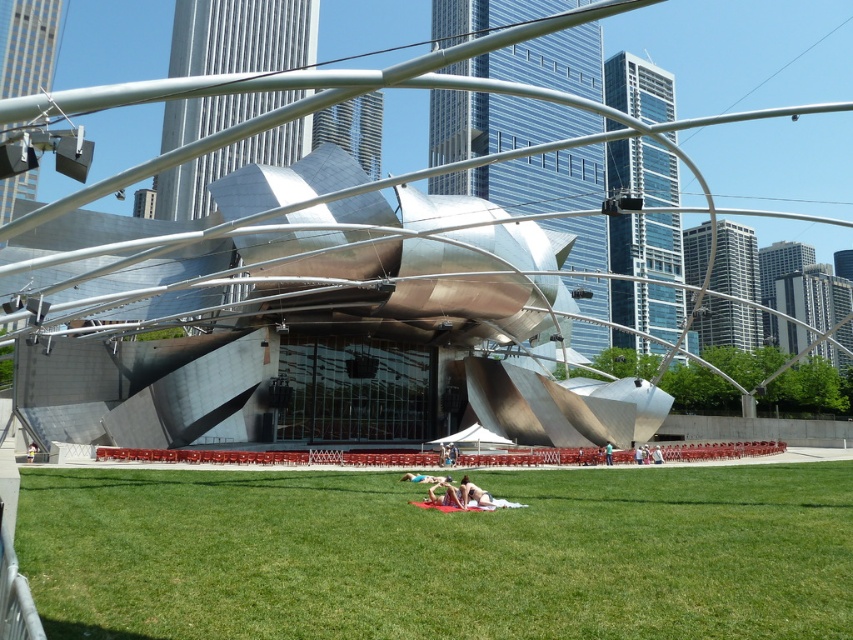
Is skinny jeans at center thinner than smooth skin person at center?

Correct, skinny jeans at center's width is less than smooth skin person at center's.

In the scene shown: Is skinny jeans at center positioned behind smooth skin person at center?

No, skinny jeans at center is closer to the viewer.

The height and width of the screenshot is (640, 853). What do you see at coordinates (444, 493) in the screenshot?
I see `skinny jeans at center` at bounding box center [444, 493].

This screenshot has width=853, height=640. Find the location of `skinny jeans at center`. skinny jeans at center is located at coordinates (444, 493).

Is green grass at lower center bigger than skinny jeans at center?

Indeed, green grass at lower center has a larger size compared to skinny jeans at center.

Is green grass at lower center smaller than skinny jeans at center?

Actually, green grass at lower center might be larger than skinny jeans at center.

Measure the distance between green grass at lower center and camera.

They are 5.95 meters apart.

You are a GUI agent. You are given a task and a screenshot of the screen. Output one action in this format:
    pyautogui.click(x=<x>, y=<y>)
    Task: Click on the green grass at lower center
    The width and height of the screenshot is (853, 640).
    Given the screenshot: What is the action you would take?
    pyautogui.click(x=440, y=554)

What do you see at coordinates (440, 554) in the screenshot?
I see `green grass at lower center` at bounding box center [440, 554].

This screenshot has width=853, height=640. Describe the element at coordinates (440, 554) in the screenshot. I see `green grass at lower center` at that location.

Where is `green grass at lower center`? green grass at lower center is located at coordinates (440, 554).